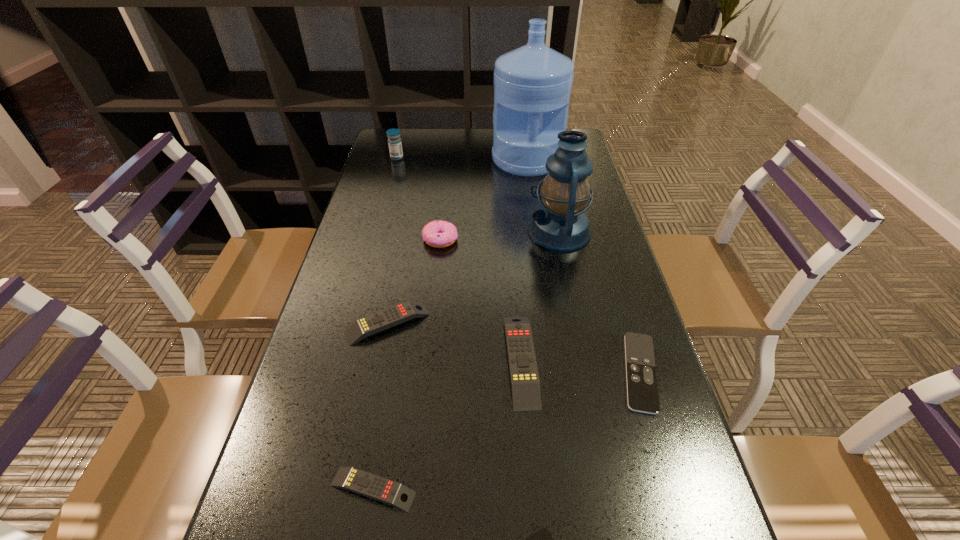
Locate which yellow remote control is the second closest to the eighth farthest object. Please provide its 2D coordinates. Your answer should be formatted as a tuple, i.e. [(x, y)], where the tuple contains the x and y coordinates of a point satisfying the conditions above.

[(377, 322)]

You are a GUI agent. You are given a task and a screenshot of the screen. Output one action in this format:
    pyautogui.click(x=<x>, y=<y>)
    Task: Click on the yellow remote control that is the third nearest to the smaller black remote control
    
    Given the screenshot: What is the action you would take?
    pyautogui.click(x=377, y=322)

Identify the location of vacant space that satisfies the following two spatial constraints: 1. on the face of the lantern; 2. on the front side of the sixth tallest object. (578, 323).

The width and height of the screenshot is (960, 540). In order to click on vacant space that satisfies the following two spatial constraints: 1. on the front side of the bigger black remote control; 2. on the right side of the medicine in this screenshot , I will do `click(339, 372)`.